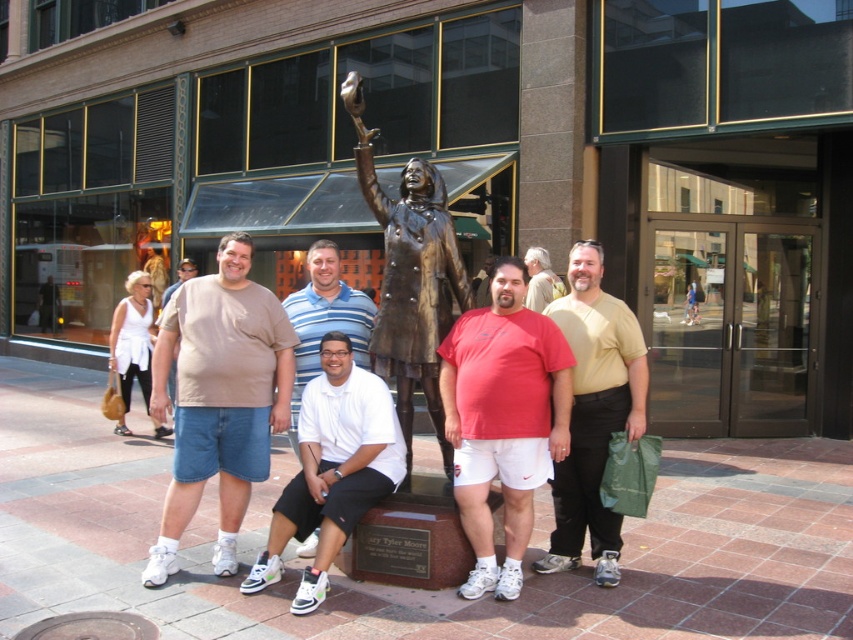
Is matte beige t-shirt at center wider than light brown shirt at center?

Indeed, matte beige t-shirt at center has a greater width compared to light brown shirt at center.

Who is more distant from viewer, (241, 468) or (560, 289)?

The point (560, 289) is behind.

In order to click on matte beige t-shirt at center in this screenshot , I will do `click(219, 397)`.

Based on the photo, between matte red t-shirt at center and bronze statue at center, which one is positioned higher?

Positioned higher is bronze statue at center.

Between matte red t-shirt at center and bronze statue at center, which one is positioned lower?

matte red t-shirt at center is below.

Is point (498, 291) farther from camera compared to point (410, 376)?

No, it is not.

Locate an element on the screen. The height and width of the screenshot is (640, 853). matte red t-shirt at center is located at coordinates (503, 420).

Can you confirm if matte beige t-shirt at center is positioned above matte yellow t-shirt at center?

Yes.

Which is above, matte beige t-shirt at center or matte yellow t-shirt at center?

matte beige t-shirt at center is higher up.

Is point (224, 451) positioned in front of point (579, 317)?

Yes, point (224, 451) is in front of point (579, 317).

Locate an element on the screen. The width and height of the screenshot is (853, 640). matte beige t-shirt at center is located at coordinates (219, 397).